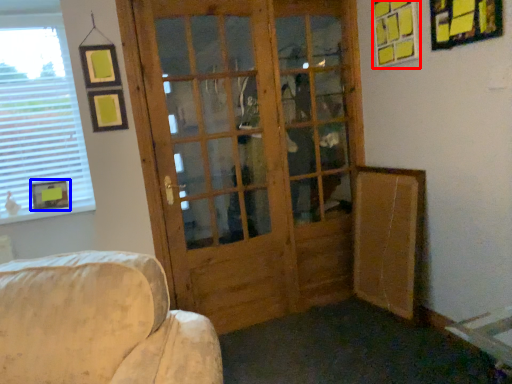
Question: Among these objects, which one is nearest to the camera, picture frame (highlighted by a red box) or picture frame (highlighted by a blue box)?

Choices:
 (A) picture frame
 (B) picture frame

Answer: (A)